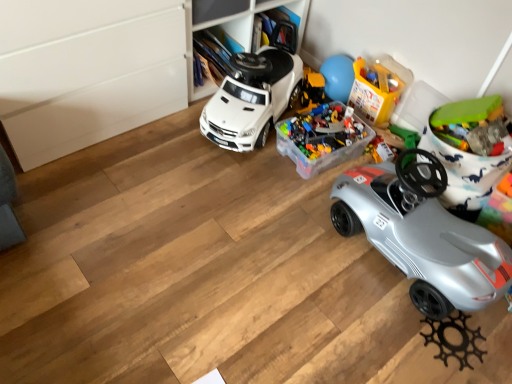
Question: From the image's perspective, is silver metallic car at lower right, the 2th car viewed from the left, above or below translucent plastic container at center, which is counted as the third toy, starting from the right?

Choices:
 (A) above
 (B) below

Answer: (B)

Question: Is silver metallic car at lower right, placed as the first car when sorted from right to left, bigger or smaller than translucent plastic container at center, the 1th toy positioned from the left?

Choices:
 (A) small
 (B) big

Answer: (B)

Question: Which is farther from the white matte toy car at center, the 1th car positioned from the left?

Choices:
 (A) translucent plastic container at upper center, arranged as the 2th toy when viewed from the left
 (B) translucent plastic container at center, which is counted as the third toy, starting from the right
 (C) silver metallic car at lower right, placed as the first car when sorted from right to left
 (D) green plastic toy at upper right, the first toy in the right-to-left sequence

Answer: (D)

Question: Considering the real-world distances, which object is farthest from the white matte toy car at center, the 1th car positioned from the left?

Choices:
 (A) translucent plastic container at center, which is counted as the third toy, starting from the right
 (B) green plastic toy at upper right, marked as the third toy in a left-to-right arrangement
 (C) silver metallic car at lower right, the 2th car viewed from the left
 (D) translucent plastic container at upper center, arranged as the 2th toy when viewed from the left

Answer: (B)